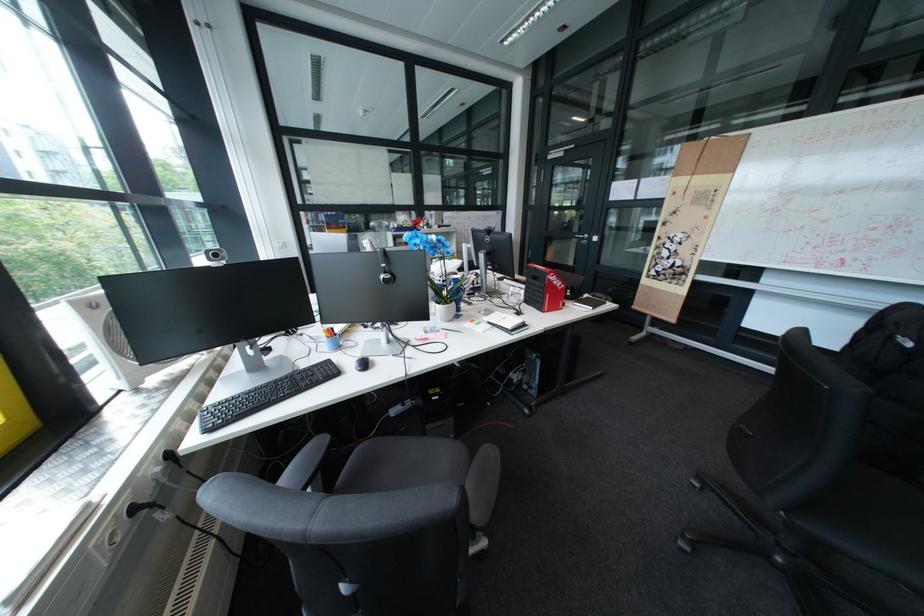
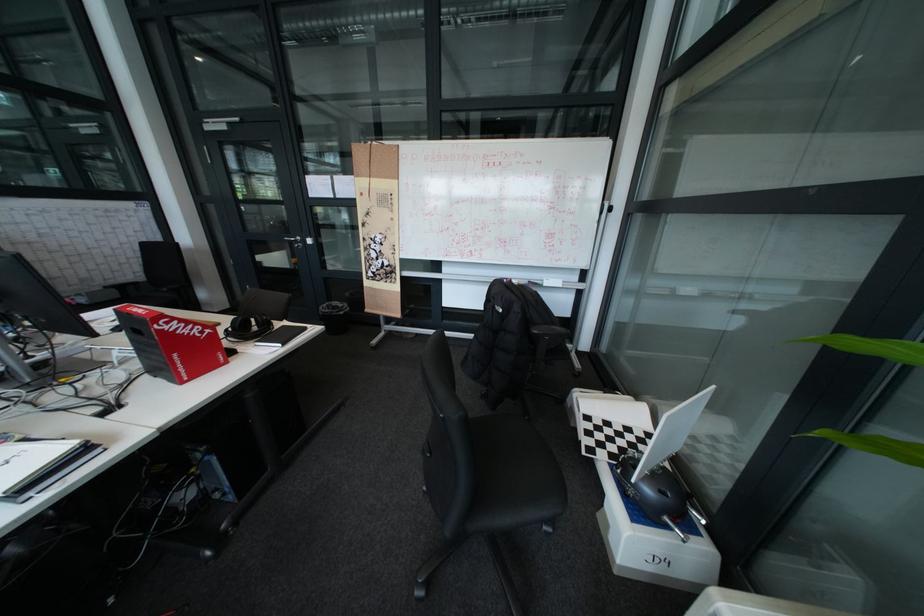
In the second image, find the point that corresponds to (x=538, y=326) in the first image.

(99, 452)